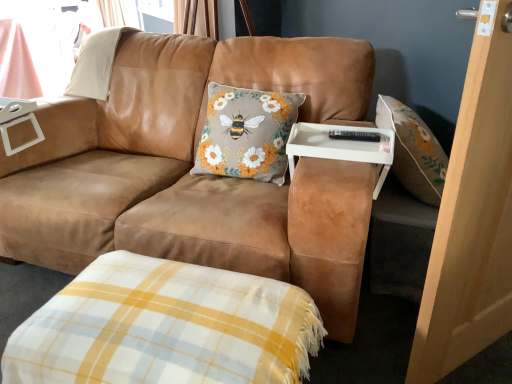
Question: Is white plastic tray at center taller than yellow and white plaid blanket at lower center?

Choices:
 (A) no
 (B) yes

Answer: (A)

Question: Considering the relative sizes of white plastic tray at center and yellow and white plaid blanket at lower center in the image provided, is white plastic tray at center smaller than yellow and white plaid blanket at lower center?

Choices:
 (A) no
 (B) yes

Answer: (B)

Question: Would you consider white plastic tray at center to be distant from yellow and white plaid blanket at lower center?

Choices:
 (A) yes
 (B) no

Answer: (B)

Question: From a real-world perspective, is white plastic tray at center beneath yellow and white plaid blanket at lower center?

Choices:
 (A) no
 (B) yes

Answer: (A)

Question: From the image's perspective, is white plastic tray at center on yellow and white plaid blanket at lower center?

Choices:
 (A) yes
 (B) no

Answer: (A)

Question: Can you confirm if white plastic tray at center is bigger than yellow and white plaid blanket at lower center?

Choices:
 (A) yes
 (B) no

Answer: (B)

Question: Are yellow and white plaid blanket at lower center and suede brown couch at center far apart?

Choices:
 (A) yes
 (B) no

Answer: (B)

Question: Is yellow and white plaid blanket at lower center with suede brown couch at center?

Choices:
 (A) yes
 (B) no

Answer: (B)

Question: Can you confirm if yellow and white plaid blanket at lower center is thinner than suede brown couch at center?

Choices:
 (A) yes
 (B) no

Answer: (A)

Question: From the image's perspective, does yellow and white plaid blanket at lower center appear higher than suede brown couch at center?

Choices:
 (A) no
 (B) yes

Answer: (A)

Question: Can you confirm if yellow and white plaid blanket at lower center is positioned to the right of suede brown couch at center?

Choices:
 (A) yes
 (B) no

Answer: (A)

Question: Is yellow and white plaid blanket at lower center positioned with its back to suede brown couch at center?

Choices:
 (A) no
 (B) yes

Answer: (B)

Question: Is light brown wood screen door at right not within white plastic tray at center?

Choices:
 (A) yes
 (B) no

Answer: (A)